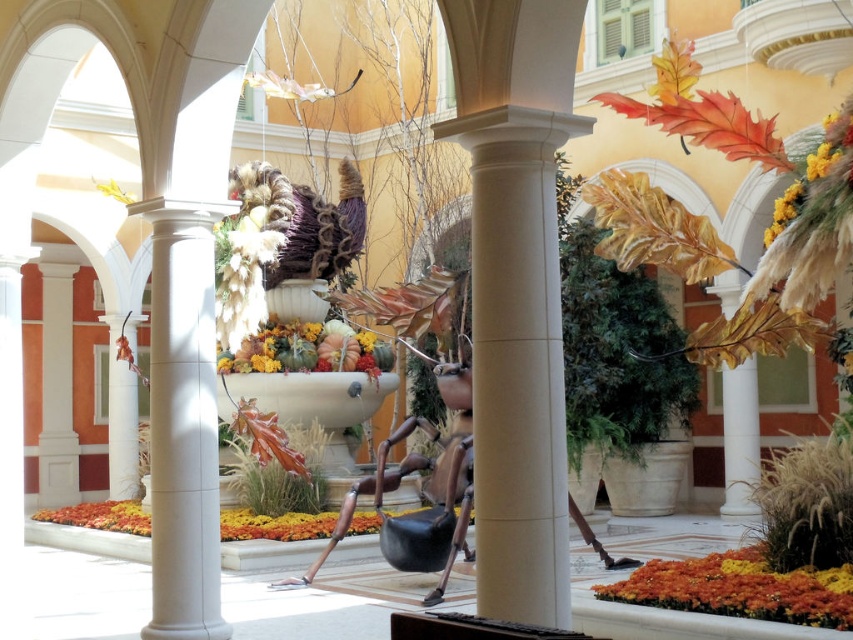
In the scene shown: Can you confirm if white smooth column at center is bigger than orange matte flowers at lower right?

No.

Between point (479, 392) and point (711, 609), which one is positioned behind?

The point (711, 609) is behind.

Find the location of `white smooth column at center`. white smooth column at center is located at coordinates (515, 291).

Which is more to the left, white smooth column at center or metallic gold sculpture at center?

From the viewer's perspective, metallic gold sculpture at center appears more on the left side.

You are a GUI agent. You are given a task and a screenshot of the screen. Output one action in this format:
    pyautogui.click(x=<x>, y=<y>)
    Task: Click on the white smooth column at center
    The image size is (853, 640).
    Given the screenshot: What is the action you would take?
    pyautogui.click(x=515, y=291)

Is point (474, 316) closer to viewer compared to point (396, 468)?

Yes, point (474, 316) is in front of point (396, 468).

This screenshot has height=640, width=853. In order to click on white smooth column at center in this screenshot , I will do `click(515, 291)`.

Can you confirm if orange matte flowers at lower right is positioned to the right of metallic gold sculpture at center?

Yes, orange matte flowers at lower right is to the right of metallic gold sculpture at center.

Which is above, orange matte flowers at lower right or metallic gold sculpture at center?

Positioned higher is metallic gold sculpture at center.

Where is `orange matte flowers at lower right`? The height and width of the screenshot is (640, 853). orange matte flowers at lower right is located at coordinates (740, 588).

You are a GUI agent. You are given a task and a screenshot of the screen. Output one action in this format:
    pyautogui.click(x=<x>, y=<y>)
    Task: Click on the orange matte flowers at lower right
    
    Given the screenshot: What is the action you would take?
    pyautogui.click(x=740, y=588)